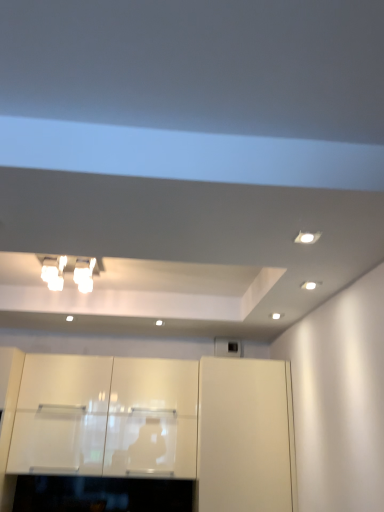
Question: Does point (89, 272) appear closer or farther from the camera than point (205, 395)?

Choices:
 (A) farther
 (B) closer

Answer: (B)

Question: In the image, is white glossy light fixture at upper left positioned in front of or behind white glossy cabinet at center, positioned as the first cabinetry in right-to-left order?

Choices:
 (A) front
 (B) behind

Answer: (A)

Question: Which object is positioned closest to the glossy white cabinets at center, which is counted as the second cabinetry, starting from the right?

Choices:
 (A) white glossy light fixture at upper left
 (B) white glossy cabinet at center, the 3th cabinetry in the left-to-right sequence
 (C) white glossy cabinet at center, which is the 1th cabinetry from left to right

Answer: (C)

Question: Which object is positioned farthest from the white glossy light fixture at upper left?

Choices:
 (A) white glossy cabinet at center, the 3th cabinetry in the left-to-right sequence
 (B) glossy white cabinets at center, which is the second cabinetry from left to right
 (C) white glossy cabinet at center, which is the 1th cabinetry from left to right

Answer: (A)